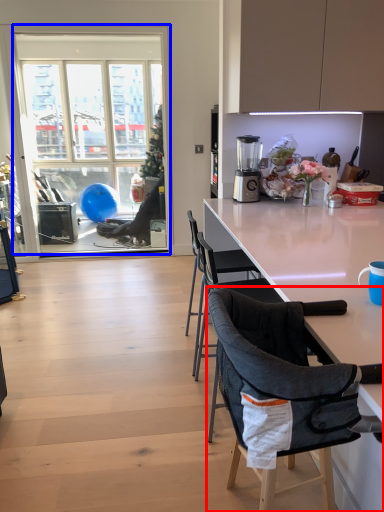
Question: Which of the following is the farthest to the observer, chair (highlighted by a red box) or window (highlighted by a blue box)?

Choices:
 (A) chair
 (B) window

Answer: (B)